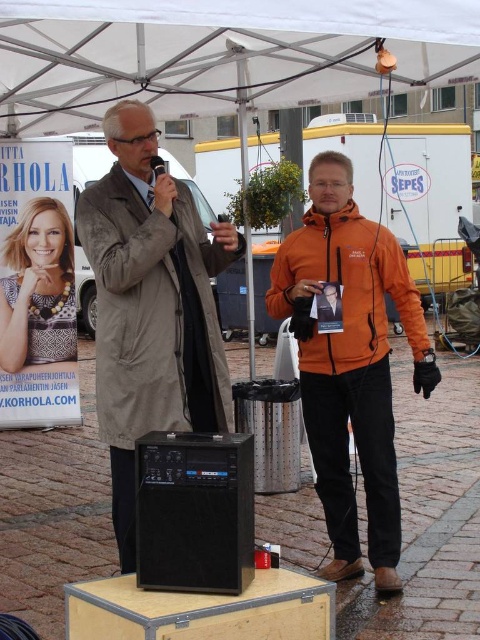
Question: Which object is farther from the camera taking this photo?

Choices:
 (A) orange fleece jacket at center
 (B) gray fabric trench coat at upper left

Answer: (A)

Question: Which object appears farthest from the camera in this image?

Choices:
 (A) orange fleece jacket at center
 (B) white fabric canopy at upper center

Answer: (B)

Question: Does white fabric canopy at upper center have a lesser width compared to gray fabric trench coat at upper left?

Choices:
 (A) no
 (B) yes

Answer: (A)

Question: Is gray fabric trench coat at upper left closer to the viewer compared to orange fleece jacket at center?

Choices:
 (A) no
 (B) yes

Answer: (B)

Question: Which point is farther to the camera?

Choices:
 (A) (187, 364)
 (B) (344, 472)
 (C) (183, 8)

Answer: (B)

Question: Can you confirm if white fabric canopy at upper center is thinner than gray fabric trench coat at upper left?

Choices:
 (A) no
 (B) yes

Answer: (A)